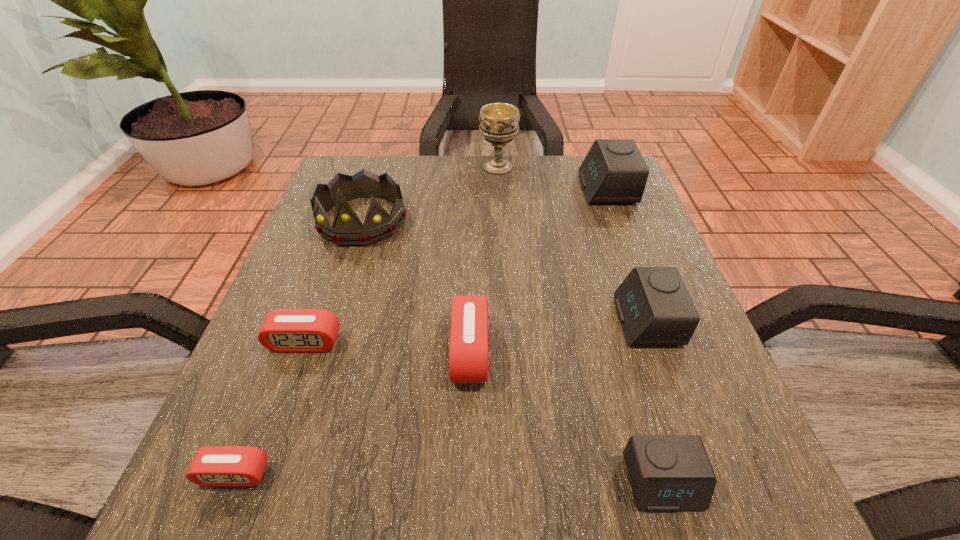
You are a GUI agent. You are given a task and a screenshot of the screen. Output one action in this format:
    pyautogui.click(x=<x>, y=<y>)
    Task: Click on the vacant area at the far edge
    
    Given the screenshot: What is the action you would take?
    pyautogui.click(x=514, y=192)

Identify the location of blank area at the near edge. (557, 502).

The image size is (960, 540). I want to click on free space at the left edge of the desktop, so click(x=300, y=278).

In the image, there is a desktop. Where is `vacant space at the right edge`? This screenshot has height=540, width=960. vacant space at the right edge is located at coordinates (644, 247).

The image size is (960, 540). I want to click on free space at the near right corner of the desktop, so click(x=691, y=530).

Identify the location of free area in between the tiara and the biggest black alarm clock. (484, 205).

The image size is (960, 540). In order to click on free space between the farthest alarm clock and the white chalice in this screenshot , I will do `click(552, 178)`.

I want to click on vacant space that's between the tiara and the nearest black alarm clock, so click(x=513, y=352).

You are a GUI agent. You are given a task and a screenshot of the screen. Output one action in this format:
    pyautogui.click(x=<x>, y=<y>)
    Task: Click on the vacant point located between the shortest object and the second smallest pink alarm clock
    The width and height of the screenshot is (960, 540).
    Given the screenshot: What is the action you would take?
    pyautogui.click(x=270, y=408)

The image size is (960, 540). What are the coordinates of `unoccupied position between the chalice and the second farthest black alarm clock` in the screenshot? It's located at (572, 244).